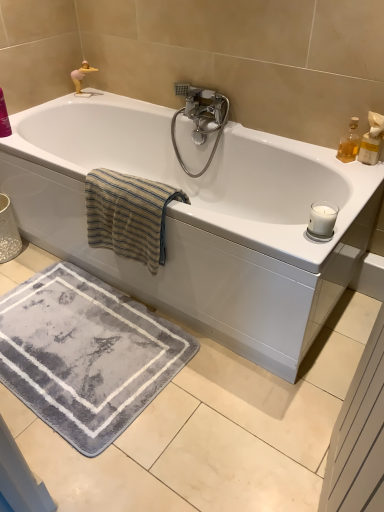
Question: Considering the relative positions of polished chrome faucet at upper center and translucent glass bottle at upper right in the image provided, is polished chrome faucet at upper center to the left of translucent glass bottle at upper right from the viewer's perspective?

Choices:
 (A) no
 (B) yes

Answer: (B)

Question: Does polished chrome faucet at upper center have a smaller size compared to translucent glass bottle at upper right?

Choices:
 (A) no
 (B) yes

Answer: (A)

Question: Is polished chrome faucet at upper center bigger than translucent glass bottle at upper right?

Choices:
 (A) no
 (B) yes

Answer: (B)

Question: Is polished chrome faucet at upper center shorter than translucent glass bottle at upper right?

Choices:
 (A) yes
 (B) no

Answer: (B)

Question: From the image's perspective, would you say polished chrome faucet at upper center is positioned over translucent glass bottle at upper right?

Choices:
 (A) no
 (B) yes

Answer: (B)

Question: Based on their sizes in the image, would you say beige striped towel at upper left is bigger or smaller than polished chrome faucet at upper center?

Choices:
 (A) big
 (B) small

Answer: (A)

Question: Is beige striped towel at upper left spatially inside polished chrome faucet at upper center, or outside of it?

Choices:
 (A) outside
 (B) inside

Answer: (A)

Question: Is beige striped towel at upper left to the left or to the right of polished chrome faucet at upper center in the image?

Choices:
 (A) left
 (B) right

Answer: (A)

Question: In the image, is beige striped towel at upper left positioned in front of or behind polished chrome faucet at upper center?

Choices:
 (A) behind
 (B) front

Answer: (B)

Question: From a real-world perspective, is beige striped towel at upper left positioned above or below white glossy bathtub at center?

Choices:
 (A) below
 (B) above

Answer: (B)

Question: Is beige striped towel at upper left in front of or behind white glossy bathtub at center in the image?

Choices:
 (A) front
 (B) behind

Answer: (B)

Question: Is beige striped towel at upper left bigger or smaller than white glossy bathtub at center?

Choices:
 (A) small
 (B) big

Answer: (A)

Question: From the image's perspective, is beige striped towel at upper left above or below white glossy bathtub at center?

Choices:
 (A) below
 (B) above

Answer: (A)

Question: From the image's perspective, is white glossy bathtub at center positioned above or below beige striped towel at upper left?

Choices:
 (A) below
 (B) above

Answer: (B)

Question: In terms of height, does white glossy bathtub at center look taller or shorter compared to beige striped towel at upper left?

Choices:
 (A) tall
 (B) short

Answer: (A)